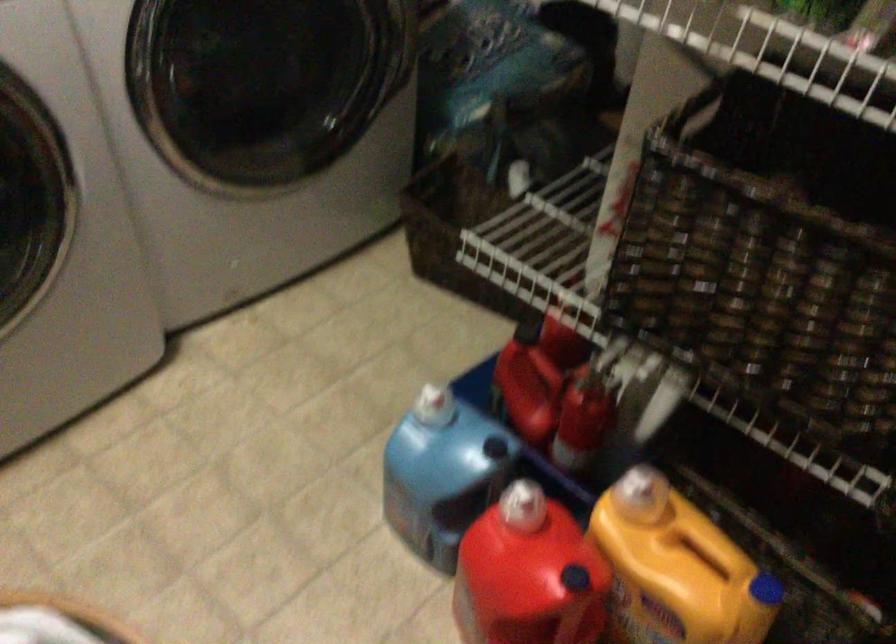
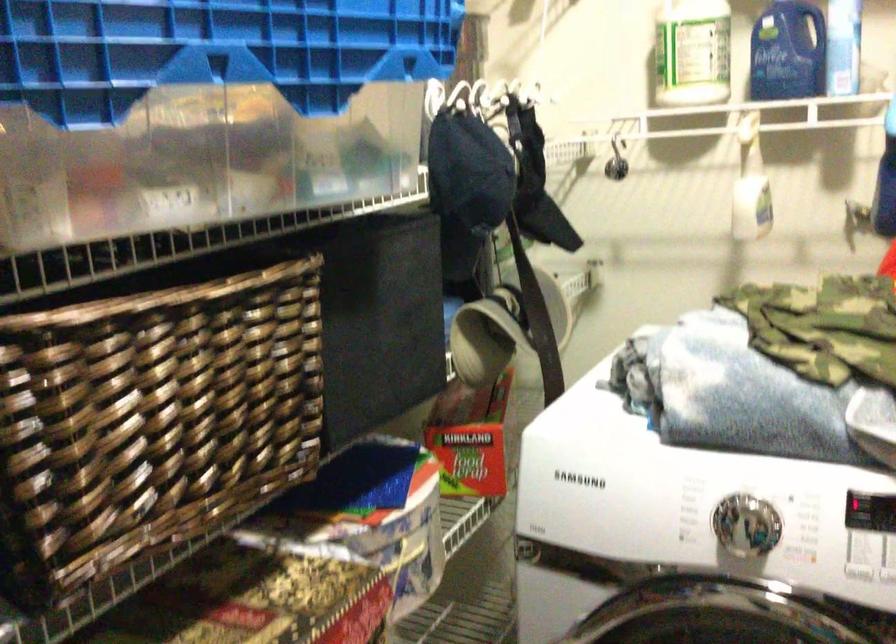
Question: The camera is either moving clockwise (left) or counter-clockwise (right) around the object. The first image is from the beginning of the video and the second image is from the end. Is the camera moving left or right when shooting the video?

Choices:
 (A) Left
 (B) Right

Answer: (B)